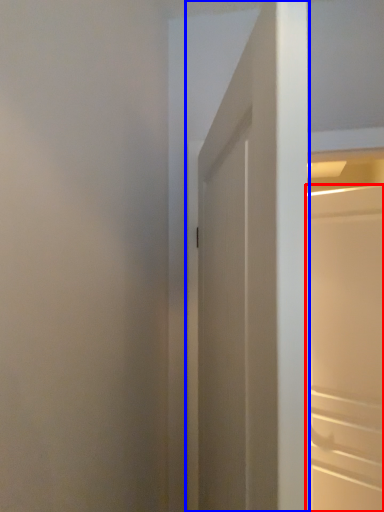
Question: Which object is further to the camera taking this photo, door (highlighted by a red box) or door (highlighted by a blue box)?

Choices:
 (A) door
 (B) door

Answer: (A)